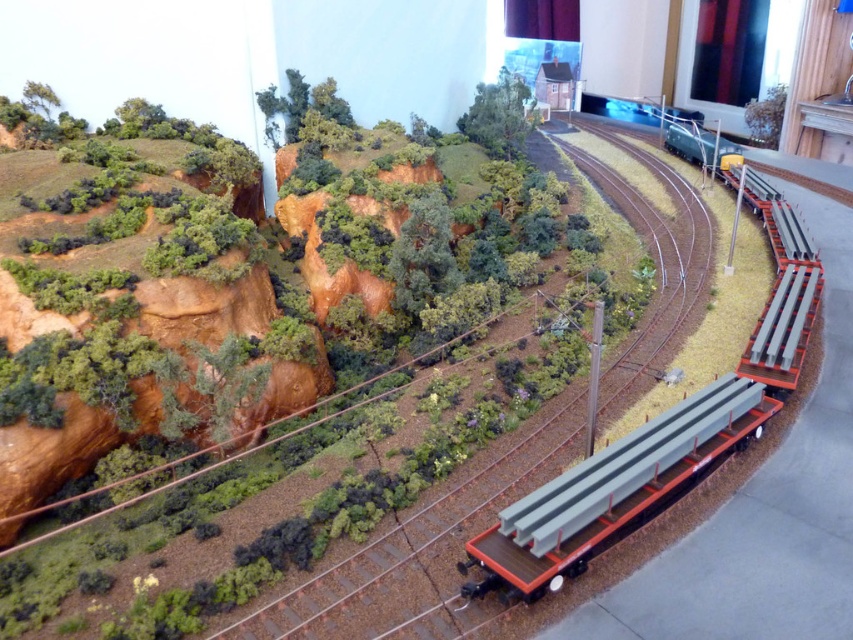
You are a model train enthusiast who wants to place a new miniature figure between the metallic gray train track at center and the metallic gray beams at right. Which object should you place the figure closer to if you want it to be on the lower elevation?

The metallic gray beams at right are lower in elevation than the metallic gray train track at center, so placing the miniature figure closer to the metallic gray beams at right would position it on the lower elevation.

You are a model train enthusiast who wants to place a new miniature car that is 2 inches long between the metallic gray train track at center and the metallic gray beams at right. Can you fit it without overlapping either object?

The metallic gray train track at center is 24.16 inches away from the metallic gray beams at right. Since the new miniature car is only 2 inches long, there is sufficient space between them to place the car without overlapping either object.

In the model railway scene, there is a metallic gray train track at center and metallic gray beams at right. Which object is wider?

The metallic gray train track at center is wider than the metallic gray beams at right.